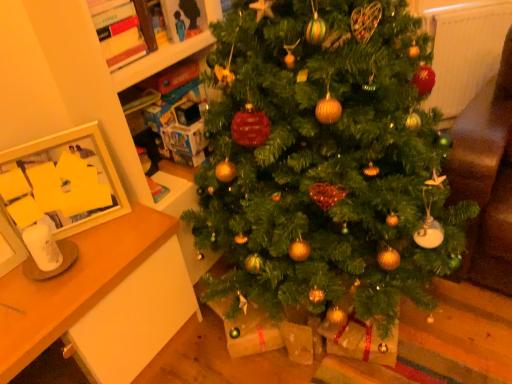
At what (x,y) coordinates should I click in order to perform the action: click on vacant point to the right of white glossy picture frame at left. Please return your answer as a coordinate pair (x, y). Looking at the image, I should click on (128, 230).